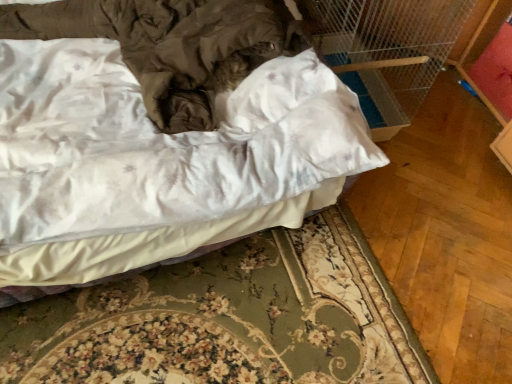
Question: Is satin white bed at center wider or thinner than white fabric bed frame at lower center?

Choices:
 (A) thin
 (B) wide

Answer: (B)

Question: Looking at the image, does satin white bed at center seem bigger or smaller compared to white fabric bed frame at lower center?

Choices:
 (A) big
 (B) small

Answer: (A)

Question: Is satin white bed at center in front of or behind white fabric bed frame at lower center in the image?

Choices:
 (A) front
 (B) behind

Answer: (A)

Question: Considering the positions of point (36, 377) and point (339, 185), is point (36, 377) closer or farther from the camera than point (339, 185)?

Choices:
 (A) closer
 (B) farther

Answer: (A)

Question: Is white fabric bed frame at lower center bigger or smaller than satin white bed at center?

Choices:
 (A) big
 (B) small

Answer: (B)

Question: Considering their positions, is white fabric bed frame at lower center located in front of or behind satin white bed at center?

Choices:
 (A) behind
 (B) front

Answer: (A)

Question: Is white fabric bed frame at lower center to the left or to the right of satin white bed at center in the image?

Choices:
 (A) left
 (B) right

Answer: (B)